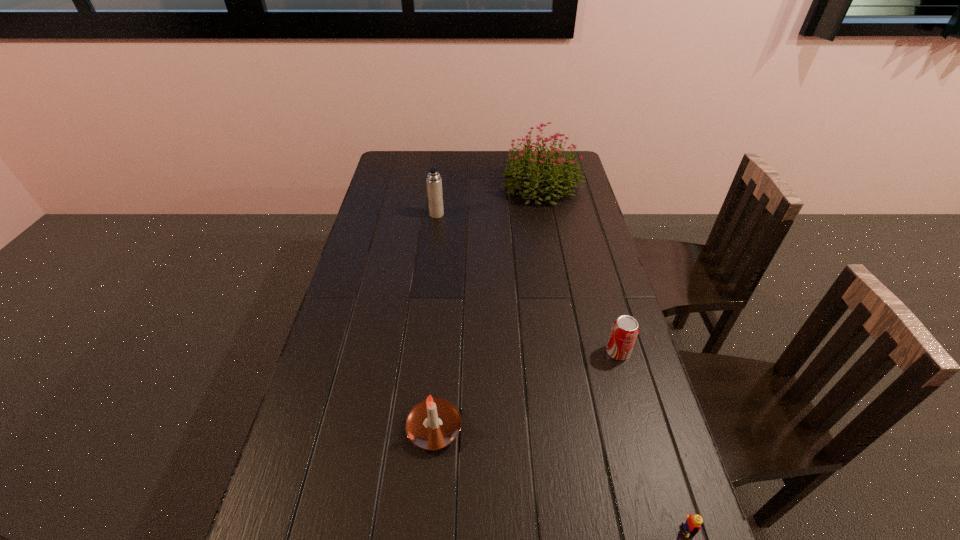
Locate an element on the screen. The image size is (960, 540). vacant point located between the candle and the second shortest object is located at coordinates (526, 390).

Find the location of `free space that is in between the second nearest object and the fourth shortest object`. free space that is in between the second nearest object and the fourth shortest object is located at coordinates click(436, 321).

Locate which object is the closest to the Lego. Please provide its 2D coordinates. Your answer should be formatted as a tuple, i.e. [(x, y)], where the tuple contains the x and y coordinates of a point satisfying the conditions above.

[(625, 329)]

Identify the location of object that is the second closest to the candle. This screenshot has width=960, height=540. click(x=692, y=526).

I want to click on free point that satisfies the following two spatial constraints: 1. on the back side of the farthest object; 2. on the left side of the second nearest object, so click(454, 185).